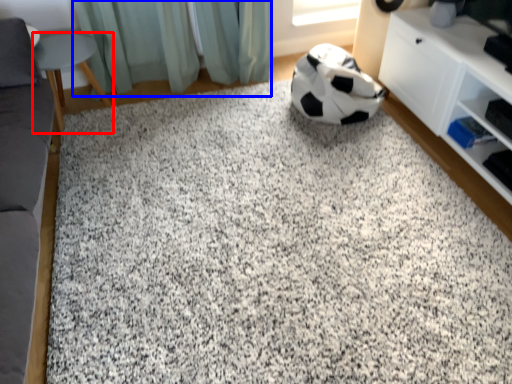
Question: Which of the following is the closest to the observer, furniture (highlighted by a red box) or curtain (highlighted by a blue box)?

Choices:
 (A) furniture
 (B) curtain

Answer: (A)